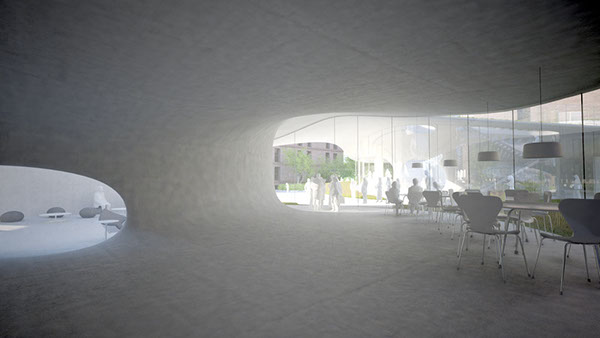
At what (x,y) coordinates should I click in order to perform the action: click on chairs. Please return your answer as a coordinate pair (x, y). This screenshot has height=338, width=600. Looking at the image, I should click on (485, 224), (583, 217), (456, 192), (597, 194).